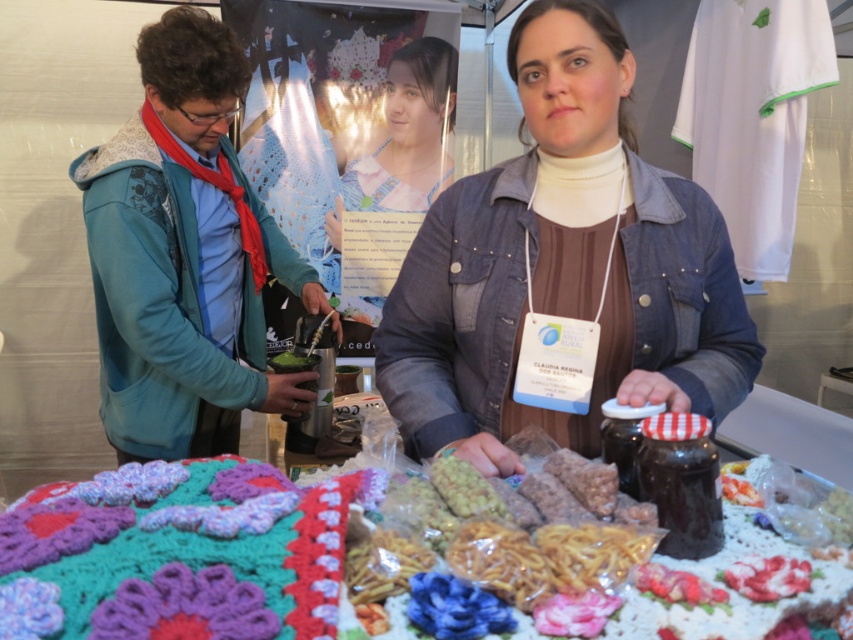
Question: Does blue fleece jacket at left have a lesser width compared to knitted fabric at lower left?

Choices:
 (A) yes
 (B) no

Answer: (B)

Question: Is denim jacket at center positioned at the back of knitted fabric at lower left?

Choices:
 (A) no
 (B) yes

Answer: (B)

Question: Based on their relative distances, which object is nearer to the denim jacket at center?

Choices:
 (A) blue fleece jacket at left
 (B) light blue fabric dress at center

Answer: (A)

Question: Among these points, which one is nearest to the camera?

Choices:
 (A) (392, 202)
 (B) (186, 284)
 (C) (514, 352)
 (D) (236, 572)

Answer: (D)

Question: Where is blue fleece jacket at left located in relation to knitted fabric at lower left in the image?

Choices:
 (A) right
 (B) left

Answer: (B)

Question: Which object appears farthest from the camera in this image?

Choices:
 (A) denim jacket at center
 (B) light blue fabric dress at center

Answer: (B)